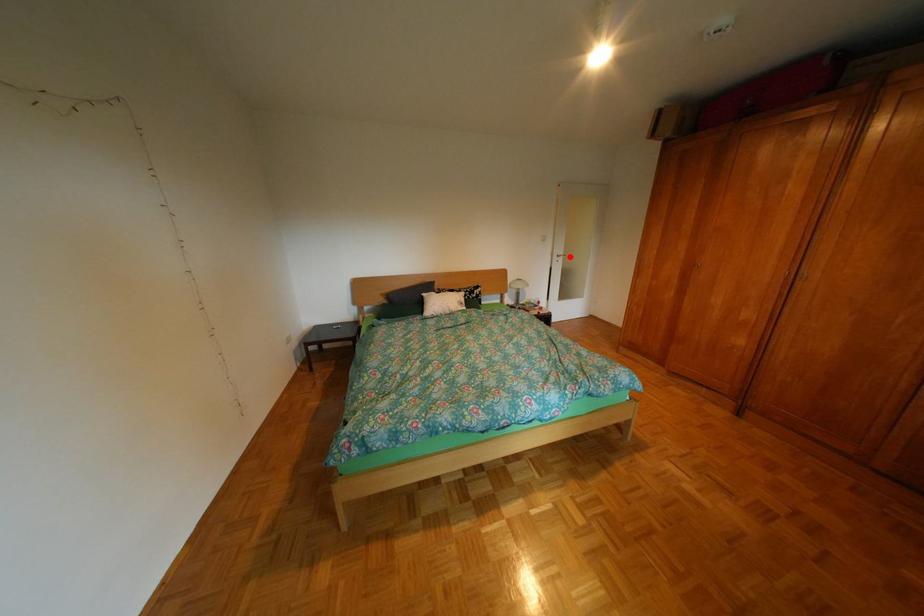
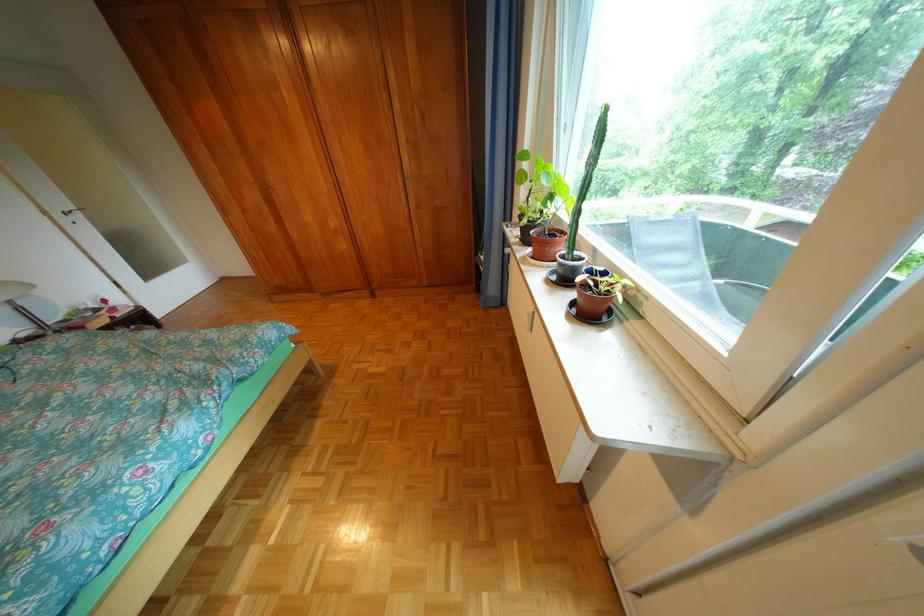
Locate, in the second image, the point that corresponds to the highlighted location in the first image.

(73, 216)